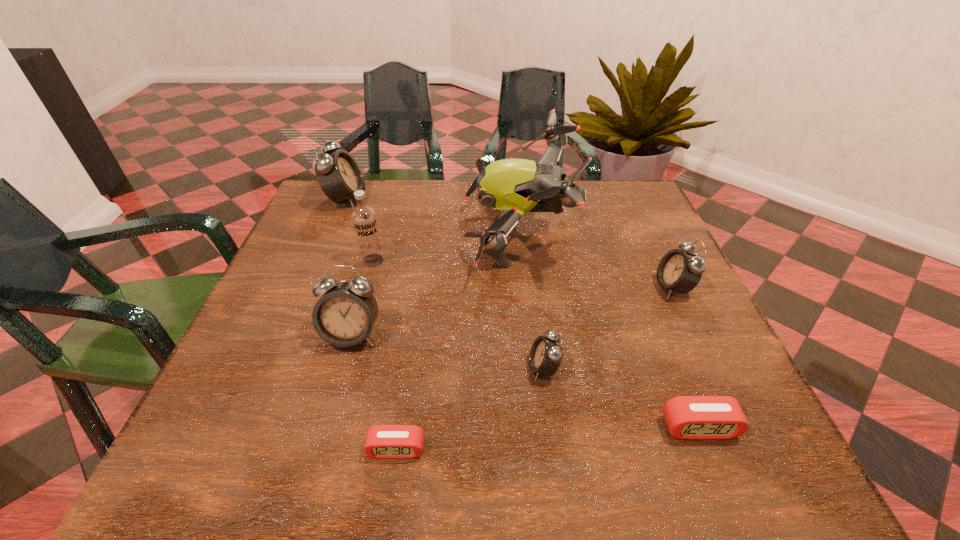
Where is `the third white alarm clock from left to right`? Image resolution: width=960 pixels, height=540 pixels. the third white alarm clock from left to right is located at coordinates (546, 353).

This screenshot has height=540, width=960. Find the location of `the bigger pink alarm clock`. the bigger pink alarm clock is located at coordinates (687, 417).

Locate an element on the screen. The height and width of the screenshot is (540, 960). the second shortest alarm clock is located at coordinates (687, 417).

Locate an element on the screen. Image resolution: width=960 pixels, height=540 pixels. the shortest alarm clock is located at coordinates (382, 441).

At what (x,y) coordinates should I click in order to perform the action: click on the shortest object. Please return your answer as a coordinate pair (x, y). Looking at the image, I should click on (382, 441).

I want to click on free space located on the front-facing side of the tallest object, so click(374, 231).

At what (x,y) coordinates should I click in order to perform the action: click on vacant space located 0.120m on the front-facing side of the tallest object. Please return your answer as a coordinate pair (x, y). The image size is (960, 540). Looking at the image, I should click on (417, 231).

Where is `free space located on the front-facing side of the tallest object`? free space located on the front-facing side of the tallest object is located at coordinates (363, 231).

Where is `vacant position located 0.370m on the front label of the vodka`? Image resolution: width=960 pixels, height=540 pixels. vacant position located 0.370m on the front label of the vodka is located at coordinates point(330,411).

At what (x,y) coordinates should I click in order to perform the action: click on vacant space located 0.390m on the face of the leftmost white alarm clock. Please return your answer as a coordinate pair (x, y). This screenshot has width=960, height=540. Looking at the image, I should click on (505, 200).